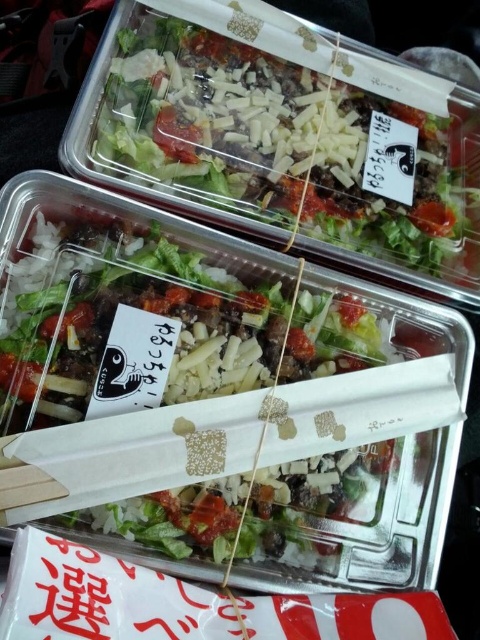
Question: Does shiny plastic salad at center have a larger size compared to translucent plastic salad at upper center?

Choices:
 (A) yes
 (B) no

Answer: (A)

Question: Can you confirm if shiny plastic salad at center is thinner than translucent plastic salad at upper center?

Choices:
 (A) yes
 (B) no

Answer: (B)

Question: Among these objects, which one is farthest from the camera?

Choices:
 (A) shiny plastic salad at center
 (B) translucent plastic salad at upper center

Answer: (B)

Question: Does shiny plastic salad at center have a smaller size compared to translucent plastic salad at upper center?

Choices:
 (A) no
 (B) yes

Answer: (A)